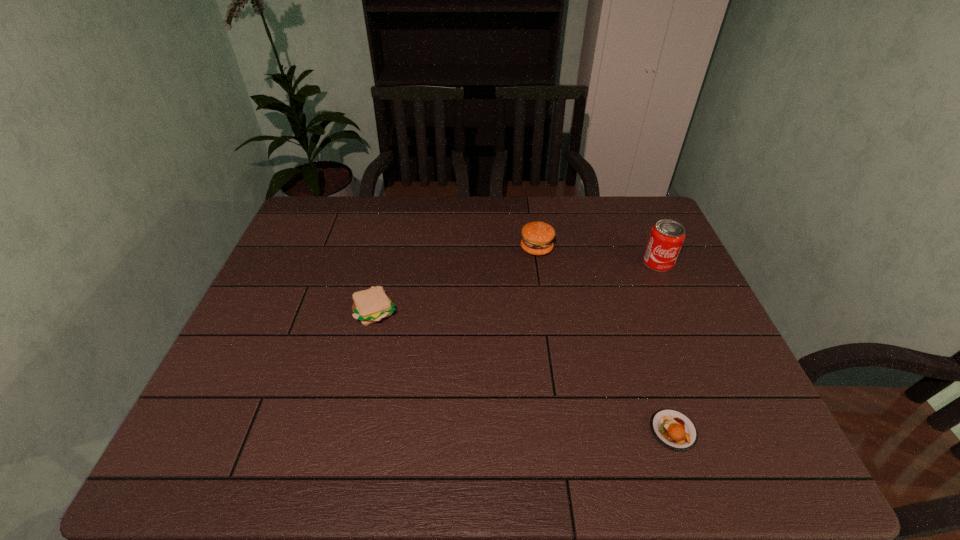
What are the coordinates of `can` in the screenshot? It's located at (666, 238).

Identify the location of the rightmost object. (666, 238).

This screenshot has height=540, width=960. I want to click on the tallest patty (food), so point(537,237).

At what (x,y) coordinates should I click in order to perform the action: click on the second patty (food) from left to right. Please return your answer as a coordinate pair (x, y). The image size is (960, 540). Looking at the image, I should click on (537, 237).

The image size is (960, 540). I want to click on the third farthest object, so click(x=371, y=305).

Locate an element on the screen. The height and width of the screenshot is (540, 960). the third tallest object is located at coordinates (371, 305).

You are a GUI agent. You are given a task and a screenshot of the screen. Output one action in this format:
    pyautogui.click(x=<x>, y=<y>)
    Task: Click on the nearest patty (food)
    
    Given the screenshot: What is the action you would take?
    pyautogui.click(x=674, y=430)

Find the location of a particular element. Image resolution: width=960 pixels, height=540 pixels. the shortest object is located at coordinates (674, 430).

This screenshot has width=960, height=540. I want to click on vacant position located 0.370m on the left of the can, so [520, 263].

Locate an element on the screen. The width and height of the screenshot is (960, 540). free location located 0.330m on the right of the third shortest object is located at coordinates (659, 248).